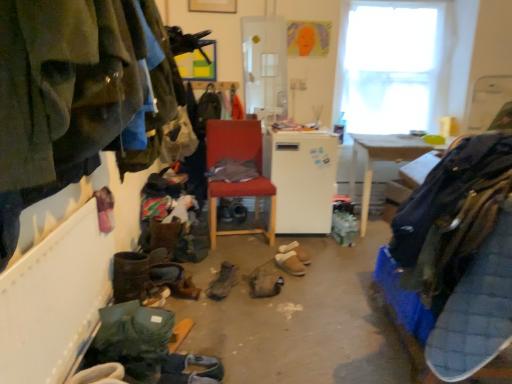
Question: From the image's perspective, is leather boots at lower center, which appears as the 2th footwear when viewed from the front, positioned above or below transparent glass window at upper right?

Choices:
 (A) below
 (B) above

Answer: (A)

Question: In the image, is leather boots at lower center, which appears as the 2th footwear when viewed from the front, on the left side or the right side of transparent glass window at upper right?

Choices:
 (A) right
 (B) left

Answer: (B)

Question: Considering the real-world distances, which object is farthest from the matte red chair at center?

Choices:
 (A) white matte refrigerator at center
 (B) wooden table at right
 (C) dark gray suede shoes at lower center, arranged as the 1th footwear when viewed from the front
 (D) green suede jacket at left, the first clothing from the left
 (E) leather boots at lower center, the fifth footwear from the back

Answer: (D)

Question: Which object is the farthest from the wooden table at right?

Choices:
 (A) transparent glass window at upper right
 (B) leather boots at center, which ranks as the fourth footwear in back-to-front order
 (C) leather boot at center, which is the fourth footwear from front to back
 (D) brown suede sandals at center, which is the sixth footwear from front to back
 (E) green suede jacket at left, which is the 2th clothing in right-to-left order

Answer: (E)